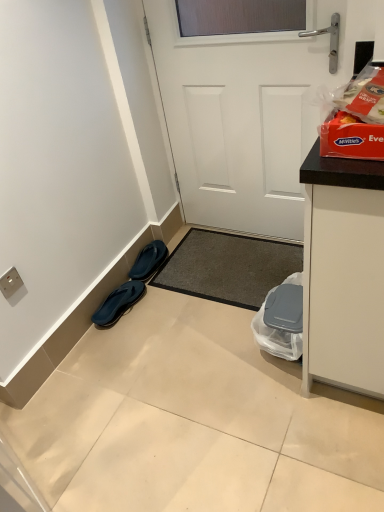
Where is `vacant space in front of black rubber flip-flops at lower left, which is counted as the 1th footwear, starting from the top`? vacant space in front of black rubber flip-flops at lower left, which is counted as the 1th footwear, starting from the top is located at coordinates (162, 289).